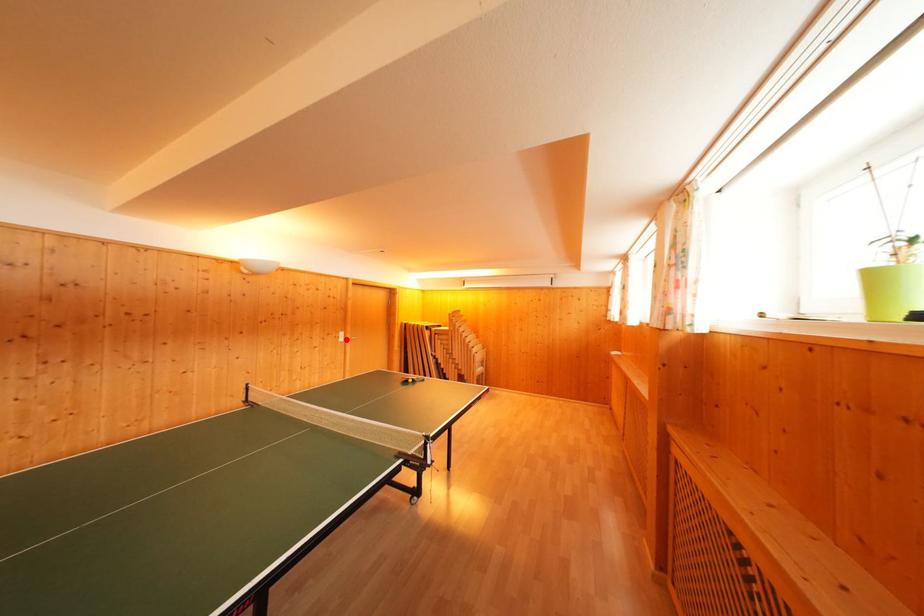
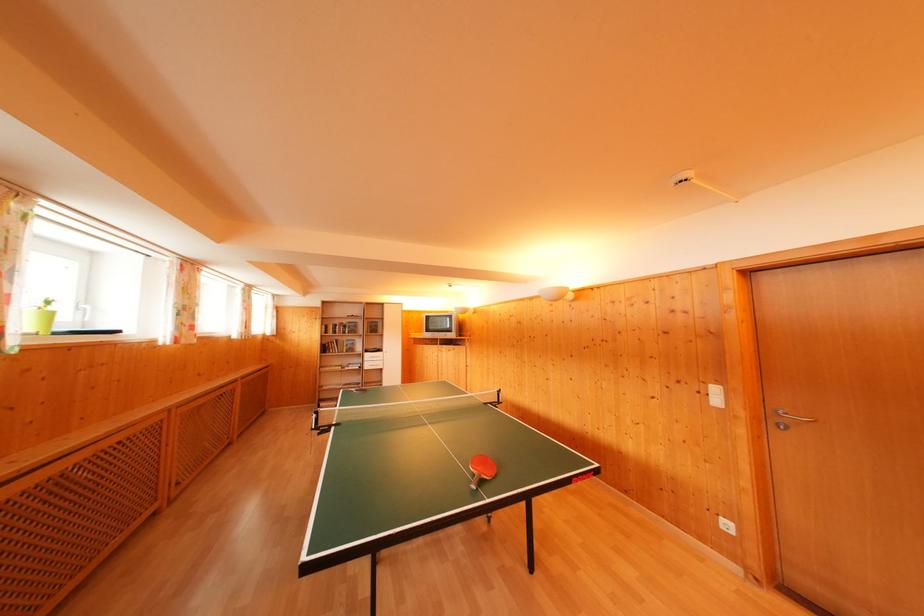
In the second image, find the point that corresponds to the highlighted location in the first image.

(721, 395)